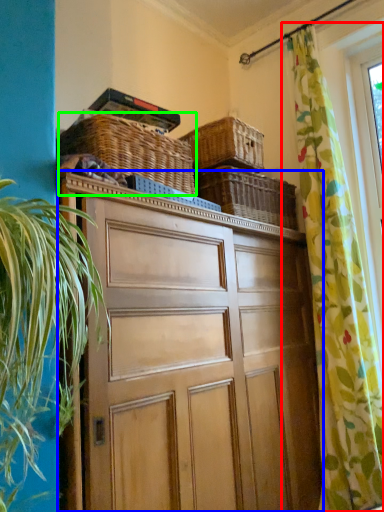
Question: Which is farther away from curtain (highlighted by a red box)? cabinetry (highlighted by a blue box) or basket (highlighted by a green box)?

Choices:
 (A) cabinetry
 (B) basket

Answer: (B)